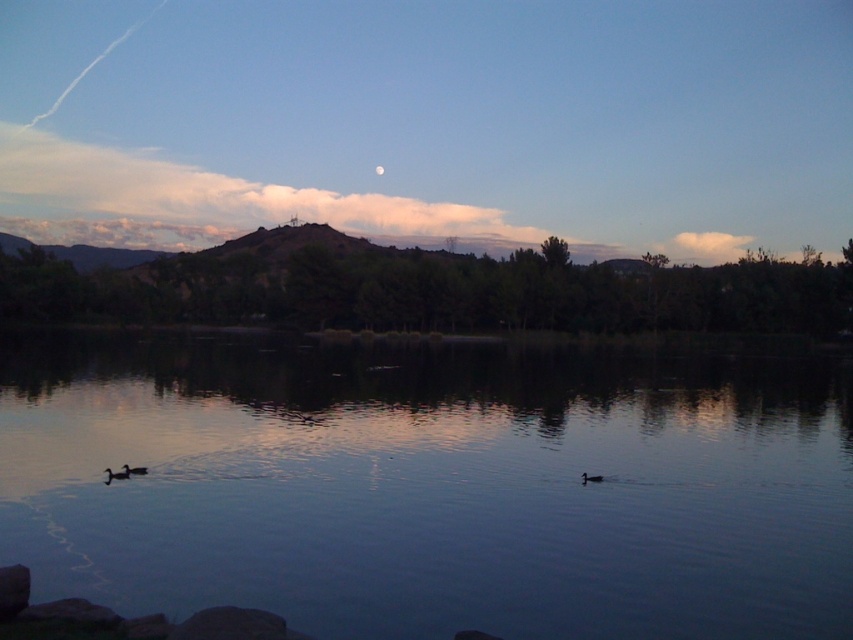
Looking at this image, does clear water at center have a smaller size compared to dark brown duck at lower left?

Incorrect, clear water at center is not smaller in size than dark brown duck at lower left.

Does point (439, 627) come behind point (103, 480)?

No.

Is point (271, 481) positioned before point (115, 472)?

No, it is not.

Locate an element on the screen. This screenshot has height=640, width=853. clear water at center is located at coordinates click(433, 484).

What do you see at coordinates (115, 474) in the screenshot?
I see `dark brown duck at lower left` at bounding box center [115, 474].

How much distance is there between dark brown duck at lower left and matte black duck at center?

dark brown duck at lower left is 9.77 meters away from matte black duck at center.

Is point (126, 468) farther from camera compared to point (595, 481)?

No, (126, 468) is in front of (595, 481).

This screenshot has width=853, height=640. I want to click on dark brown duck at lower left, so click(x=115, y=474).

Who is shorter, dark brown duck at lower left or dark gray feathers duck at lower left?

dark brown duck at lower left

Consider the image. Who is positioned more to the left, dark brown duck at lower left or dark gray feathers duck at lower left?

dark brown duck at lower left

Who is more forward, [125,472] or [134,468]?

Point [125,472] is in front.

Locate an element on the screen. This screenshot has height=640, width=853. dark brown duck at lower left is located at coordinates (115, 474).